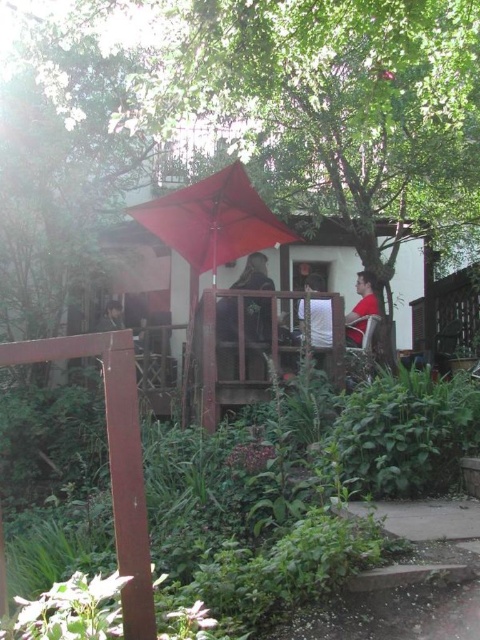
Question: Which point is farther to the camera?

Choices:
 (A) red matte chair at right
 (B) white fabric at center

Answer: (A)

Question: Is red fabric umbrella at center to the right of white fabric at center from the viewer's perspective?

Choices:
 (A) no
 (B) yes

Answer: (A)

Question: Considering the relative positions of green leafy tree at upper center and green leafy plants at lower center in the image provided, where is green leafy tree at upper center located with respect to green leafy plants at lower center?

Choices:
 (A) above
 (B) below

Answer: (A)

Question: Which object appears closest to the camera in this image?

Choices:
 (A) red matte chair at right
 (B) dark gray jacket at lower left
 (C) red fabric umbrella at center

Answer: (C)

Question: Is red fabric umbrella at center to the right of dark gray jacket at lower left from the viewer's perspective?

Choices:
 (A) yes
 (B) no

Answer: (A)

Question: Which point appears closest to the camera in this image?

Choices:
 (A) (105, 324)
 (B) (332, 17)

Answer: (B)